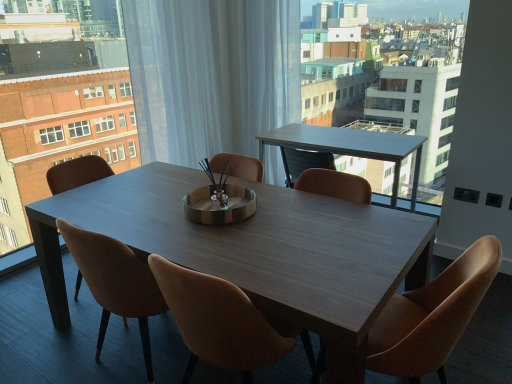
Locate an element on the screen. The width and height of the screenshot is (512, 384). wooden table at center is located at coordinates 255,251.

You are a GUI agent. You are given a task and a screenshot of the screen. Output one action in this format:
    pyautogui.click(x=<x>, y=<y>)
    Task: Click on the brown leather chair at center, the 1th chair from the left
    The width and height of the screenshot is (512, 384).
    Given the screenshot: What is the action you would take?
    pyautogui.click(x=77, y=173)

How much space does matte wood table at center, which appears as the 2th condominium when viewed from the right, occupy horizontally?

matte wood table at center, which appears as the 2th condominium when viewed from the right, is 18.53 centimeters wide.

How much space does brown leather chair at center, marked as the second chair in a right-to-left arrangement, occupy horizontally?

23.84 inches.

This screenshot has width=512, height=384. What are the coordinates of `leather at center, which is the third chair in left-to-right order` in the screenshot? It's located at (432, 315).

In order to face smooth white table at upper right, the second condominium when ordered from left to right, should I rotate leftwards or rightwards?

Rotate your view right by about 12.118°.

You are a GUI agent. You are given a task and a screenshot of the screen. Output one action in this format:
    pyautogui.click(x=<x>, y=<y>)
    Task: Click on the wooden table at center
    This screenshot has width=512, height=384.
    Given the screenshot: What is the action you would take?
    pyautogui.click(x=255, y=251)

Considering the relative sizes of brown leather chair at center, which is counted as the 2th chair, starting from the left, and leather at center, placed as the 1th chair when sorted from right to left, in the image provided, is brown leather chair at center, which is counted as the 2th chair, starting from the left, shorter than leather at center, placed as the 1th chair when sorted from right to left,?

Indeed, brown leather chair at center, which is counted as the 2th chair, starting from the left, has a lesser height compared to leather at center, placed as the 1th chair when sorted from right to left.

From the image's perspective, is brown leather chair at center, marked as the second chair in a right-to-left arrangement, located above leather at center, placed as the 1th chair when sorted from right to left?

No, from the image's perspective, brown leather chair at center, marked as the second chair in a right-to-left arrangement, is not on top of leather at center, placed as the 1th chair when sorted from right to left.

Is point (258, 361) farther from camera compared to point (430, 345)?

Yes, it is.

Looking at this image, is brown leather chair at center, marked as the second chair in a right-to-left arrangement, positioned far away from leather at center, which is the third chair in left-to-right order?

No, there isn't a large distance between brown leather chair at center, marked as the second chair in a right-to-left arrangement, and leather at center, which is the third chair in left-to-right order.

In terms of width, does light brown wooden table at upper center look wider or thinner when compared to brown leather chair at center, the 3th chair positioned from the right?

Considering their sizes, light brown wooden table at upper center looks slimmer than brown leather chair at center, the 3th chair positioned from the right.

Considering the sizes of objects light brown wooden table at upper center and brown leather chair at center, the 1th chair from the left, in the image provided, who is bigger, light brown wooden table at upper center or brown leather chair at center, the 1th chair from the left,?

brown leather chair at center, the 1th chair from the left, is bigger.

Is light brown wooden table at upper center far away from brown leather chair at center, the 3th chair positioned from the right?

Absolutely, light brown wooden table at upper center is distant from brown leather chair at center, the 3th chair positioned from the right.

Based on the photo, would you consider matte wood table at center, which appears as the 2th condominium when viewed from the right, to be distant from leather at center, which is the third chair in left-to-right order?

Yes, matte wood table at center, which appears as the 2th condominium when viewed from the right, and leather at center, which is the third chair in left-to-right order, are quite far apart.

Looking at this image, between matte wood table at center, which is counted as the first condominium, starting from the left, and leather at center, placed as the 1th chair when sorted from right to left, which one has larger size?

matte wood table at center, which is counted as the first condominium, starting from the left.

From the image's perspective, is matte wood table at center, which is counted as the first condominium, starting from the left, located above leather at center, which is the third chair in left-to-right order?

Indeed, from the image's perspective, matte wood table at center, which is counted as the first condominium, starting from the left, is shown above leather at center, which is the third chair in left-to-right order.

Locate an element on the screen. chair that is the 1st object directly below the matte wood table at center, which appears as the 2th condominium when viewed from the right (from a real-world perspective) is located at coordinates (432, 315).

Is light brown wooden table at upper center at the back of translucent white curtain at upper center?

translucent white curtain at upper center does not have its back to light brown wooden table at upper center.

Who is smaller, translucent white curtain at upper center or light brown wooden table at upper center?

light brown wooden table at upper center.

Does translucent white curtain at upper center have a lesser height compared to light brown wooden table at upper center?

No.

Which object is further away from the camera, translucent white curtain at upper center or light brown wooden table at upper center?

Positioned behind is translucent white curtain at upper center.

Considering the sizes of smooth white table at upper right, the second condominium when ordered from left to right, and translucent white curtain at upper center in the image, is smooth white table at upper right, the second condominium when ordered from left to right, taller or shorter than translucent white curtain at upper center?

Considering their sizes, smooth white table at upper right, the second condominium when ordered from left to right, has more height than translucent white curtain at upper center.

Can you see smooth white table at upper right, the second condominium when ordered from left to right, touching translucent white curtain at upper center?

They are not placed beside each other.

Find the location of a particular element. The image size is (512, 384). condominium on the right of translucent white curtain at upper center is located at coordinates (392, 95).

Is smooth white table at upper right, the second condominium when ordered from left to right, in front of or behind translucent white curtain at upper center in the image?

Visually, smooth white table at upper right, the second condominium when ordered from left to right, is located in front of translucent white curtain at upper center.

Is wooden table at center a part of brown leather chair at center, the 1th chair from the left?

No.

Consider the image. Is brown leather chair at center, the 1th chair from the left, to the left of wooden table at center from the viewer's perspective?

Yes, brown leather chair at center, the 1th chair from the left, is to the left of wooden table at center.

Locate an element on the screen. The height and width of the screenshot is (384, 512). kitchen & dining room table below the brown leather chair at center, the 1th chair from the left (from a real-world perspective) is located at coordinates (255, 251).

Is brown leather chair at center, the 1th chair from the left, positioned before wooden table at center?

No, it is behind wooden table at center.

Is matte wood table at center, which appears as the 2th condominium when viewed from the right, in contact with brown leather chair at center, which is counted as the 2th chair, starting from the left?

No, matte wood table at center, which appears as the 2th condominium when viewed from the right, is not making contact with brown leather chair at center, which is counted as the 2th chair, starting from the left.

Looking at this image, which is more to the left, matte wood table at center, which is counted as the first condominium, starting from the left, or brown leather chair at center, which is counted as the 2th chair, starting from the left?

Positioned to the left is matte wood table at center, which is counted as the first condominium, starting from the left.

Can we say matte wood table at center, which appears as the 2th condominium when viewed from the right, lies outside brown leather chair at center, which is counted as the 2th chair, starting from the left?

matte wood table at center, which appears as the 2th condominium when viewed from the right, lies outside brown leather chair at center, which is counted as the 2th chair, starting from the left,'s area.

Considering the sizes of matte wood table at center, which appears as the 2th condominium when viewed from the right, and brown leather chair at center, which is counted as the 2th chair, starting from the left, in the image, is matte wood table at center, which appears as the 2th condominium when viewed from the right, taller or shorter than brown leather chair at center, which is counted as the 2th chair, starting from the left,?

Considering their sizes, matte wood table at center, which appears as the 2th condominium when viewed from the right, has more height than brown leather chair at center, which is counted as the 2th chair, starting from the left.

You are a GUI agent. You are given a task and a screenshot of the screen. Output one action in this format:
    pyautogui.click(x=<x>, y=<y>)
    Task: Click on the chair above the brown leather chair at center, which is counted as the 2th chair, starting from the left (from a real-world perspective)
    
    Given the screenshot: What is the action you would take?
    pyautogui.click(x=432, y=315)

Where is `the 1st chair below when counting from the light brown wooden table at upper center (from the image's perspective)`? the 1st chair below when counting from the light brown wooden table at upper center (from the image's perspective) is located at coordinates (77, 173).

When comparing their distances from smooth white table at upper right, the second condominium when ordered from left to right, does brown leather chair at center, which is counted as the 2th chair, starting from the left, or leather at center, placed as the 1th chair when sorted from right to left, seem closer?

The object closer to smooth white table at upper right, the second condominium when ordered from left to right, is leather at center, placed as the 1th chair when sorted from right to left.

Looking at the image, which one is located closer to light brown wooden table at upper center, brown leather chair at center, which is counted as the 2th chair, starting from the left, or matte wood table at center, which is counted as the first condominium, starting from the left?

The object closer to light brown wooden table at upper center is matte wood table at center, which is counted as the first condominium, starting from the left.

Estimate the real-world distances between objects in this image. Which object is further from wooden table at center, matte wood table at center, which appears as the 2th condominium when viewed from the right, or smooth white table at upper right, the second condominium when ordered from left to right?

smooth white table at upper right, the second condominium when ordered from left to right.

Estimate the real-world distances between objects in this image. Which object is closer to matte wood table at center, which is counted as the first condominium, starting from the left, leather at center, placed as the 1th chair when sorted from right to left, or smooth white table at upper right, the first condominium when ordered from right to left?

leather at center, placed as the 1th chair when sorted from right to left, is closer to matte wood table at center, which is counted as the first condominium, starting from the left.

Estimate the real-world distances between objects in this image. Which object is further from light brown wooden table at upper center, brown leather chair at center, marked as the second chair in a right-to-left arrangement, or translucent white curtain at upper center?

brown leather chair at center, marked as the second chair in a right-to-left arrangement, lies further to light brown wooden table at upper center than the other object.

Which object lies further to the anchor point leather at center, which is the third chair in left-to-right order, matte wood table at center, which appears as the 2th condominium when viewed from the right, or translucent white curtain at upper center?

translucent white curtain at upper center is positioned further to the anchor leather at center, which is the third chair in left-to-right order.

Estimate the real-world distances between objects in this image. Which object is further from brown leather chair at center, marked as the second chair in a right-to-left arrangement, smooth white table at upper right, the second condominium when ordered from left to right, or matte wood table at center, which appears as the 2th condominium when viewed from the right?

Based on the image, smooth white table at upper right, the second condominium when ordered from left to right, appears to be further to brown leather chair at center, marked as the second chair in a right-to-left arrangement.

When comparing their distances from translucent white curtain at upper center, does wooden table at center or smooth white table at upper right, the first condominium when ordered from right to left, seem further?

wooden table at center.

Where is `coffee table located between matte wood table at center, which is counted as the first condominium, starting from the left, and leather at center, which is the third chair in left-to-right order, in the left-right direction`? Image resolution: width=512 pixels, height=384 pixels. coffee table located between matte wood table at center, which is counted as the first condominium, starting from the left, and leather at center, which is the third chair in left-to-right order, in the left-right direction is located at coordinates (351, 147).

You are a GUI agent. You are given a task and a screenshot of the screen. Output one action in this format:
    pyautogui.click(x=<x>, y=<y>)
    Task: Click on the coffee table between wooden table at center and smooth white table at upper right, the second condominium when ordered from left to right, from front to back
    This screenshot has width=512, height=384.
    Given the screenshot: What is the action you would take?
    pyautogui.click(x=351, y=147)

At what (x,y) coordinates should I click in order to perform the action: click on kitchen & dining room table situated between matte wood table at center, which is counted as the first condominium, starting from the left, and brown leather chair at center, marked as the second chair in a right-to-left arrangement, from left to right. Please return your answer as a coordinate pair (x, y). The height and width of the screenshot is (384, 512). Looking at the image, I should click on (255, 251).

This screenshot has width=512, height=384. Identify the location of kitchen & dining room table situated between brown leather chair at center, the 1th chair from the left, and leather at center, placed as the 1th chair when sorted from right to left, from left to right. (255, 251).